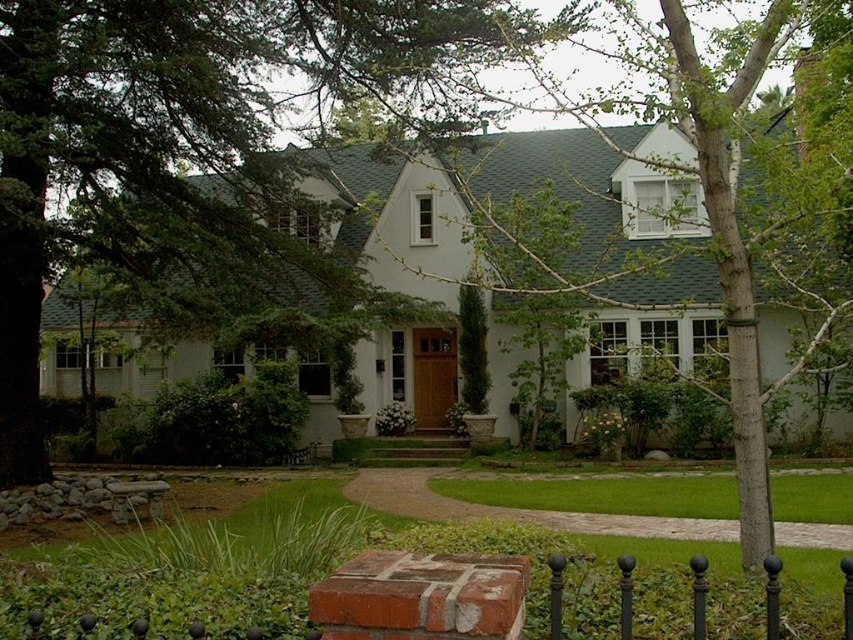
Question: Among these points, which one is nearest to the camera?

Choices:
 (A) (241, 307)
 (B) (732, 348)
 (C) (624, 504)

Answer: (B)

Question: Which of the following is the closest to the observer?

Choices:
 (A) smooth bark tree at center
 (B) green leafy tree at center

Answer: (A)

Question: Estimate the real-world distances between objects in this image. Which object is closer to the green leafy tree at center?

Choices:
 (A) smooth bark tree at center
 (B) green grass at center

Answer: (A)

Question: Does green leafy tree at center have a smaller size compared to smooth bark tree at center?

Choices:
 (A) no
 (B) yes

Answer: (B)

Question: Can you confirm if smooth bark tree at center is positioned to the left of green grass at center?

Choices:
 (A) no
 (B) yes

Answer: (A)

Question: Observing the image, what is the correct spatial positioning of green leafy tree at center in reference to green grass at center?

Choices:
 (A) above
 (B) below

Answer: (A)